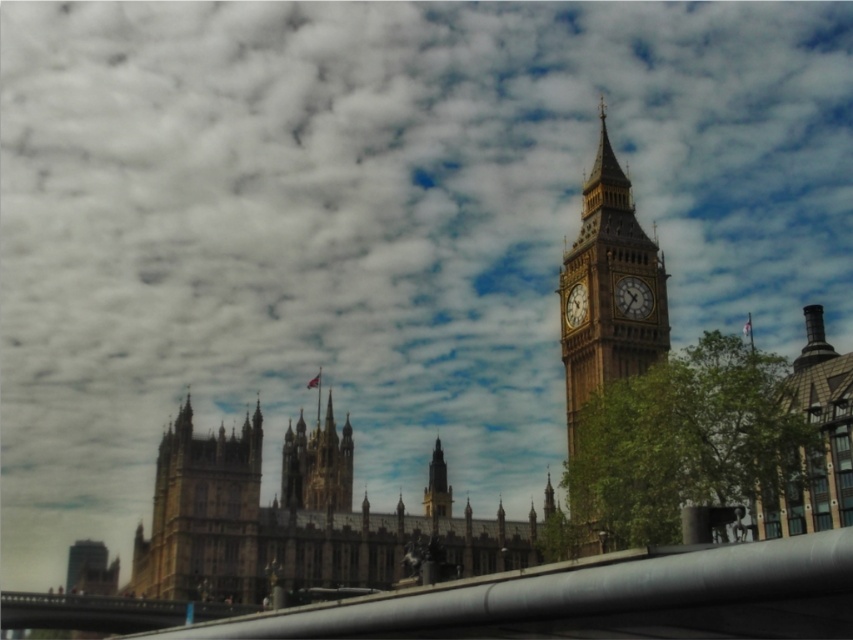
Does brown stone clock tower at right have a lesser height compared to brown stone building at right?

Incorrect, brown stone clock tower at right's height does not fall short of brown stone building at right's.

Does brown stone clock tower at right appear under brown stone building at right?

No.

Which is behind, point (643, 330) or point (759, 536)?

The point (643, 330) is behind.

The width and height of the screenshot is (853, 640). Find the location of `brown stone clock tower at right`. brown stone clock tower at right is located at coordinates (607, 291).

Is the position of gold textured clock at upper right more distant than that of gold metallic clock at right?

No.

The image size is (853, 640). Describe the element at coordinates (633, 298) in the screenshot. I see `gold textured clock at upper right` at that location.

Consider the image. Who is more forward, (619, 282) or (570, 314)?

Positioned in front is point (619, 282).

Locate an element on the screen. gold textured clock at upper right is located at coordinates (633, 298).

Does brown stone building at right have a greater width compared to gold metallic clock at right?

Yes, brown stone building at right is wider than gold metallic clock at right.

Between point (822, 467) and point (576, 321), which one is positioned in front?

Point (822, 467)

The width and height of the screenshot is (853, 640). Identify the location of brown stone building at right. (819, 436).